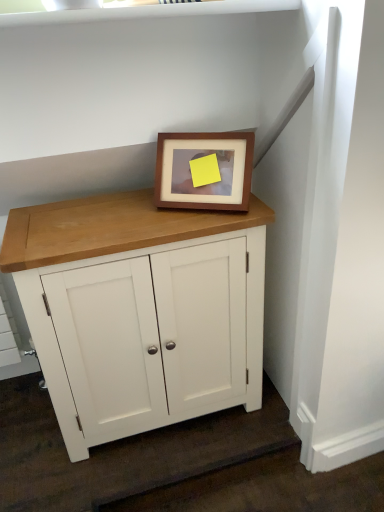
Locate an element on the screen. blank space above white painted wood cabinet at center (from a real-world perspective) is located at coordinates (103, 216).